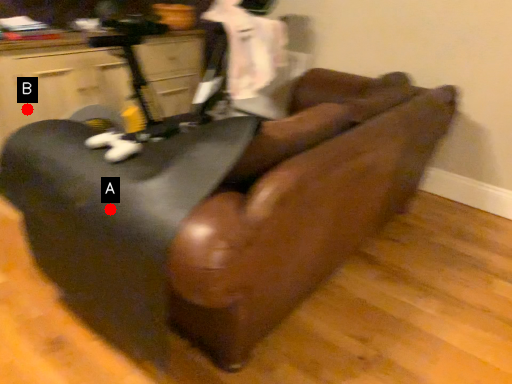
Question: Two points are circled on the image, labeled by A and B beside each circle. Which point is closer to the camera?

Choices:
 (A) A is closer
 (B) B is closer

Answer: (A)